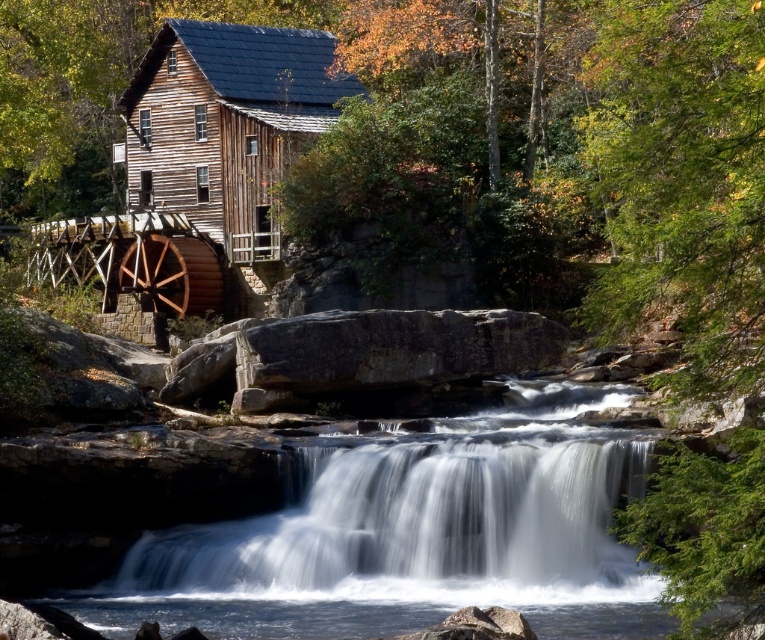
You are a photographer planning to set up a tripod to capture the white smooth water at center and the wooden cabin at center. Based on their heights, which object should you focus on first if you want to ensure both are in frame without adjusting the tripod height?

The white smooth water at center is not as tall as the wooden cabin at center, so you should focus on the wooden cabin at center first to ensure both are in frame.

You are standing in front of the mill and want to take a photo of both the white smooth water at center and the wooden cabin at center. Which object should you focus on first to ensure both are in sharp focus?

You should focus on the wooden cabin at center first because it is farther away from the viewer than the white smooth water at center, so adjusting focus from the cabin will help ensure both are in sharp focus.

You are a photographer standing at the edge of the rustic wooden mill. You want to capture the white smooth waterfall at center in your shot. Based on the coordinates provided, in which direction should you move to ensure the waterfall is centered in your camera frame?

The white smooth waterfall at center is located at coordinates point (418, 529). To center it in your camera frame, you should move to the right and slightly upwards since the current coordinates indicate it is positioned towards the right and center of the image.